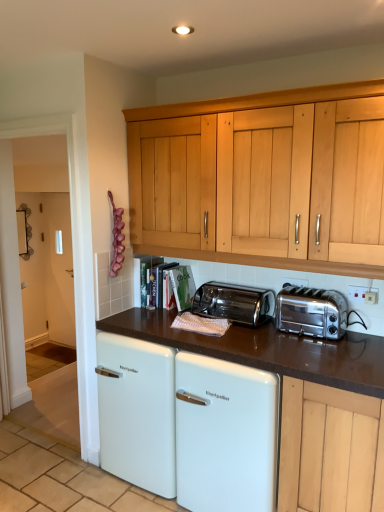
Question: Is white enamel refrigerator at center bigger or smaller than silver metallic electric outlet at upper right, placed as the 2th electric outlet when sorted from front to back?

Choices:
 (A) small
 (B) big

Answer: (B)

Question: Considering the positions of point (182, 348) and point (284, 284), is point (182, 348) closer or farther from the camera than point (284, 284)?

Choices:
 (A) farther
 (B) closer

Answer: (B)

Question: Which is farther from the silver metallic electric outlet at upper right, which is the 1th electric outlet from back to front?

Choices:
 (A) transparent glass door at left
 (B) polished stainless steel toaster at center, placed as the 2th toaster when sorted from right to left
 (C) white plastic electrical outlet at upper right, positioned as the first electric outlet in front-to-back order
 (D) white glossy refrigerator at center
 (E) satin chrome toaster at right, marked as the first toaster in a right-to-left arrangement

Answer: (A)

Question: Considering the real-world distances, which object is closest to the white plastic electrical outlet at upper right, which appears as the second electric outlet when viewed from the back?

Choices:
 (A) satin chrome toaster at right, marked as the first toaster in a right-to-left arrangement
 (B) white enamel refrigerator at center
 (C) transparent glass door at left
 (D) silver metallic electric outlet at upper right, positioned as the first electric outlet in left-to-right order
 (E) polished stainless steel toaster at center, placed as the 2th toaster when sorted from right to left

Answer: (A)